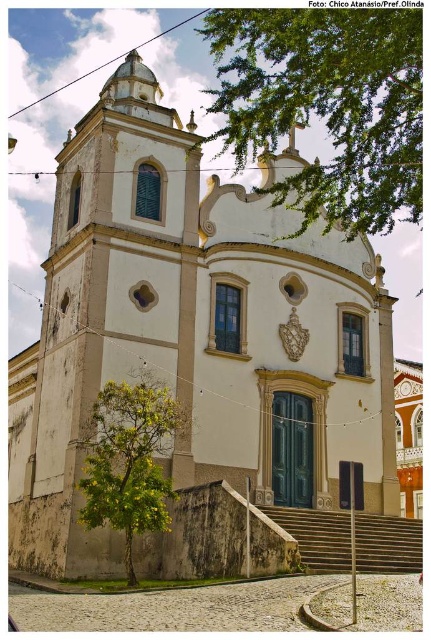
You are a tourist standing in front of the church and want to take a photo of the green leafy tree at upper center without the stone steps at center appearing in the background. Is this possible based on their positions?

The green leafy tree at upper center is positioned over the stone steps at center, so if you stand directly in front of the tree, the steps will be directly behind it and visible. To avoid the steps in the background, you would need to move to a position where the tree is not directly above the steps, but based on their described positions, this might not be feasible without altering your angle significantly.